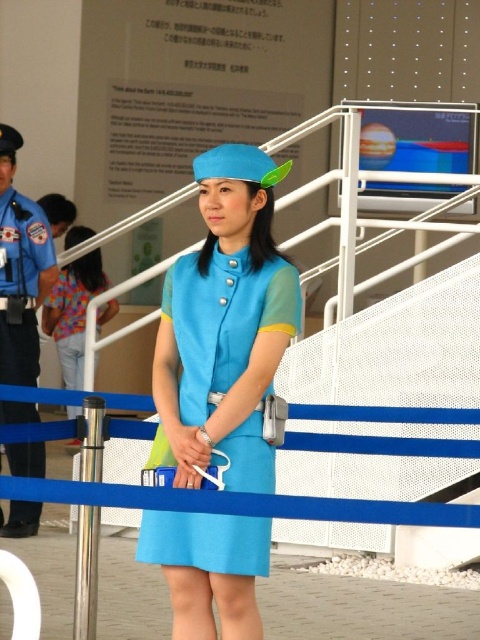
Is point (288, 292) farther from camera compared to point (76, 369)?

No, it is not.

Who is shorter, matte blue dress at center or matte blue dress at lower left?

matte blue dress at center

Does point (164, 449) come farther from viewer compared to point (84, 314)?

No.

Image resolution: width=480 pixels, height=640 pixels. Find the location of `matte blue dress at center`. matte blue dress at center is located at coordinates (224, 321).

Who is more forward, (243, 260) or (39, 275)?

Point (243, 260) is more forward.

Which of these two, matte blue dress at center or blue uniform at left, stands taller?

blue uniform at left is taller.

This screenshot has height=640, width=480. What do you see at coordinates (224, 321) in the screenshot?
I see `matte blue dress at center` at bounding box center [224, 321].

Image resolution: width=480 pixels, height=640 pixels. Find the location of `matte blue dress at center`. matte blue dress at center is located at coordinates (224, 321).

Between blue uniform at left and matte blue dress at lower left, which one appears on the right side from the viewer's perspective?

Positioned to the right is blue uniform at left.

Is blue uniform at left above matte blue dress at lower left?

Yes, blue uniform at left is above matte blue dress at lower left.

The image size is (480, 640). In order to click on blue uniform at left in this screenshot , I will do [x=21, y=269].